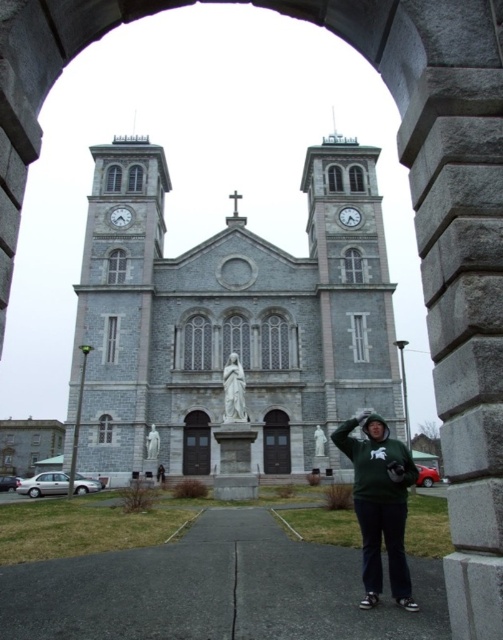
Question: Can you confirm if gray stone church at center is positioned to the left of green matte statue at center?

Choices:
 (A) yes
 (B) no

Answer: (A)

Question: Which object appears closest to the camera in this image?

Choices:
 (A) green matte statue at center
 (B) green hoodie at center
 (C) gray stone church at center

Answer: (B)

Question: Which point is closer to the camera?

Choices:
 (A) (143, 195)
 (B) (237, 408)
 (C) (322, 444)

Answer: (B)

Question: Is green hoodie at center to the left of green matte statue at center from the viewer's perspective?

Choices:
 (A) no
 (B) yes

Answer: (A)

Question: Which point appears farthest from the camera in this image?

Choices:
 (A) (315, 449)
 (B) (119, 416)
 (C) (231, 365)

Answer: (C)

Question: Is white marble statue at center below green matte statue at center?

Choices:
 (A) no
 (B) yes

Answer: (A)